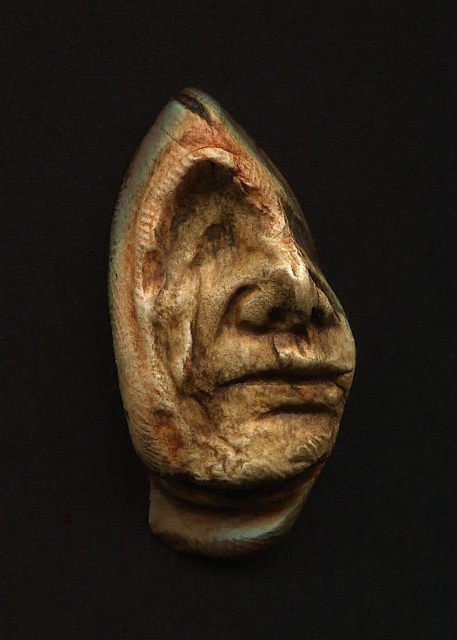
Question: Is rusty clay mask at center thinner than earthy clay mask at center?

Choices:
 (A) no
 (B) yes

Answer: (A)

Question: Can you confirm if rusty clay mask at center is smaller than earthy clay mask at center?

Choices:
 (A) yes
 (B) no

Answer: (B)

Question: Does rusty clay mask at center appear over earthy clay mask at center?

Choices:
 (A) yes
 (B) no

Answer: (A)

Question: Which of the following is the farthest from the observer?

Choices:
 (A) rusty clay mask at center
 (B) earthy clay mask at center

Answer: (B)

Question: Which point is closer to the camera?

Choices:
 (A) (216, 209)
 (B) (271, 301)

Answer: (B)